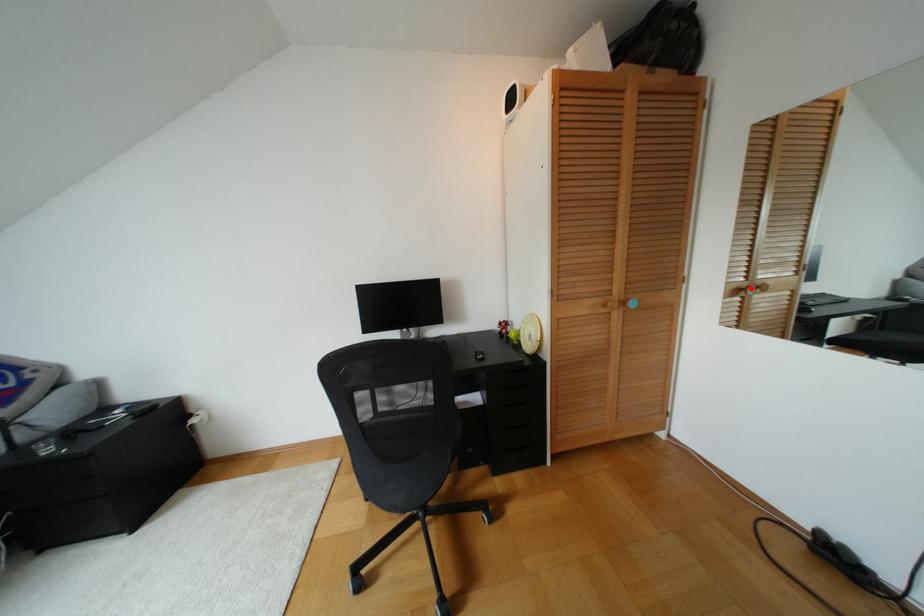
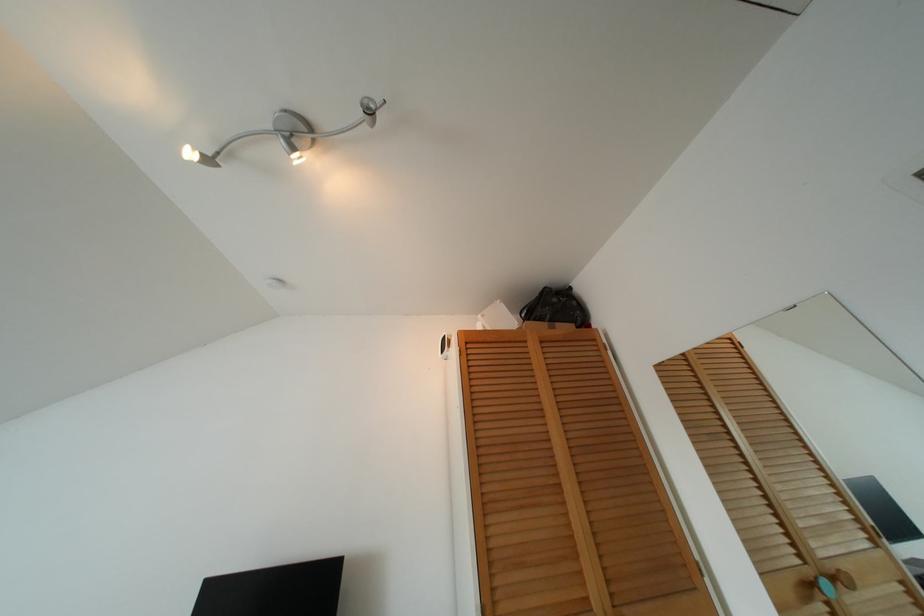
Question: I am providing you with two images of the same scene from different viewpoints. A red point is marked on the first image. Is the red point's position out of view in image 2?

Choices:
 (A) Yes
 (B) No

Answer: (B)